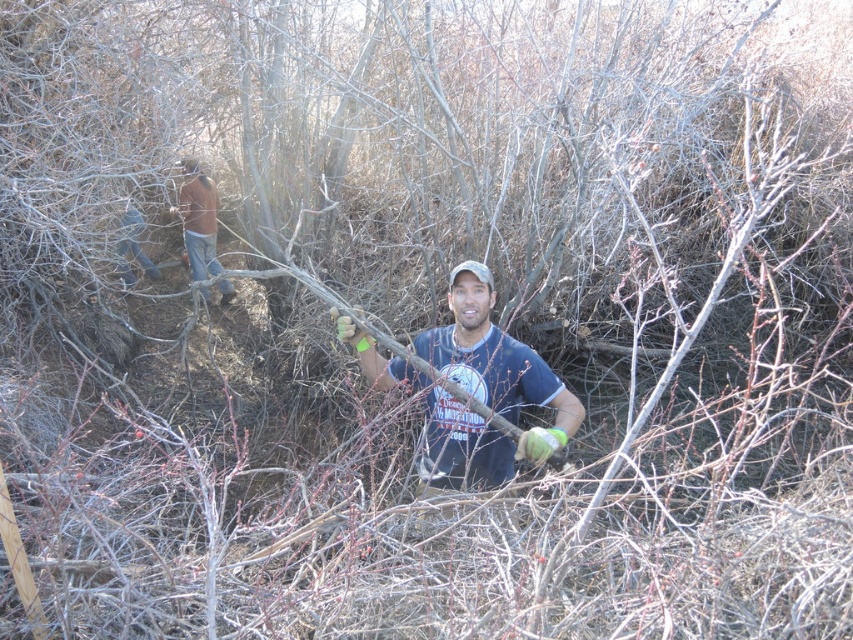
You are a hiker who just arrived at the dense thicket scene. You need to locate your brown leather jacket at upper left to put it on. Where should you look relative to the man in the center?

The brown leather jacket at upper left is located at point (198, 220), which is to the upper left of the man in the center. You should look in the upper left direction from the man to find it.

You are a photographer trying to capture a candid shot of the man in the scene. You want to ensure that both the brown leather jacket at upper left and the denim jeans at left are clearly visible in the frame. Based on their distance, can you estimate whether they will both fit within a standard camera frame?

The brown leather jacket at upper left is 26.38 inches away from denim jeans at left. Since standard camera frames can typically accommodate objects within this distance range, both items should fit within the frame as long as the camera is positioned appropriately to include both areas.